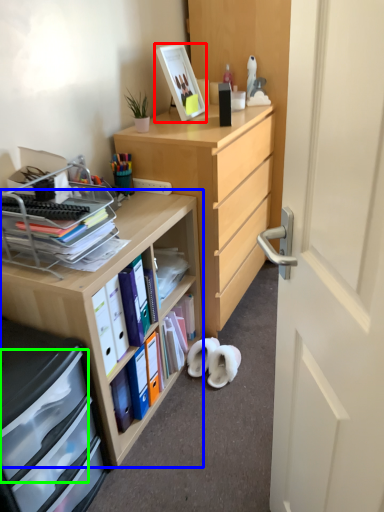
Question: Based on their relative distances, which object is nearer to picture frame (highlighted by a red box)? Choose from desk (highlighted by a blue box) and drawer (highlighted by a green box).

Choices:
 (A) desk
 (B) drawer

Answer: (A)